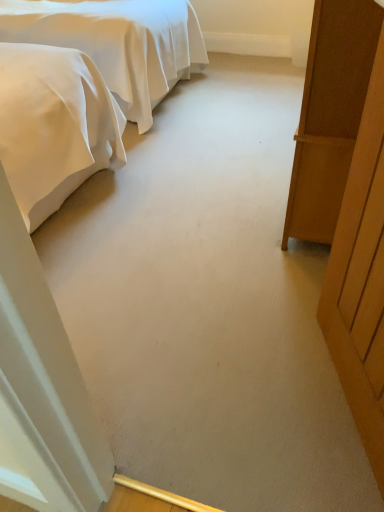
Question: Do you think wooden door at right is within wooden wardrobe at right, or outside of it?

Choices:
 (A) inside
 (B) outside

Answer: (B)

Question: Is point coord(370,113) positioned closer to the camera than point coord(311,145)?

Choices:
 (A) closer
 (B) farther

Answer: (A)

Question: Considering the real-world distances, which object is farthest from the wooden wardrobe at right?

Choices:
 (A) wooden door at right
 (B) satin white bed at upper left

Answer: (B)

Question: Which of these objects is positioned farthest from the satin white bed at upper left?

Choices:
 (A) wooden door at right
 (B) wooden wardrobe at right

Answer: (A)